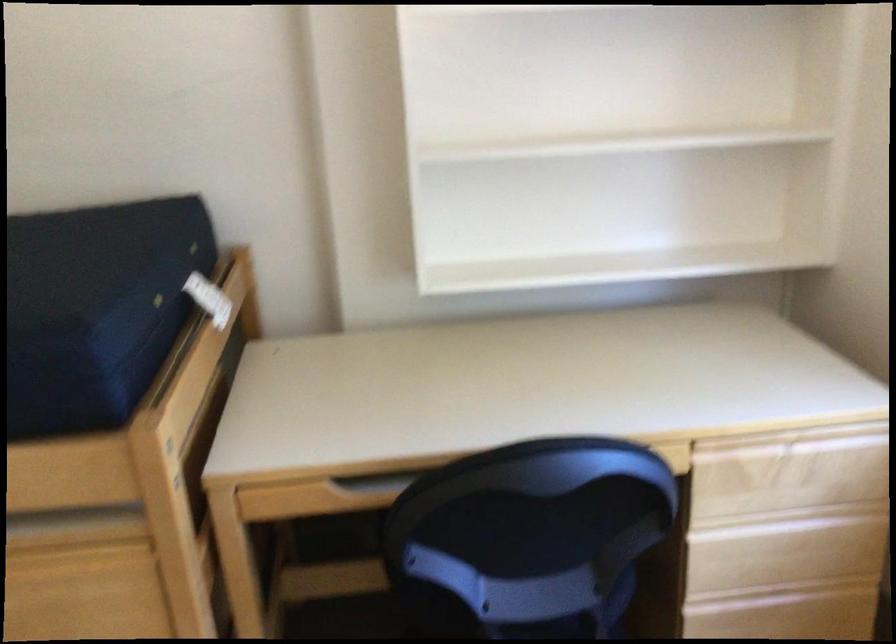
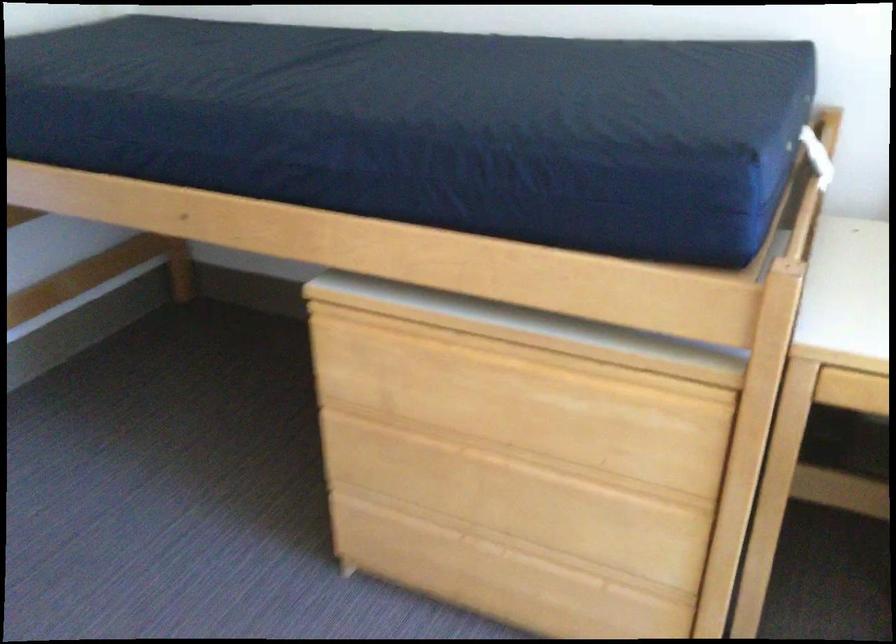
Question: The first image is from the beginning of the video and the second image is from the end. How did the camera likely rotate when shooting the video?

Choices:
 (A) Left
 (B) Right
 (C) Up
 (D) Down

Answer: (A)